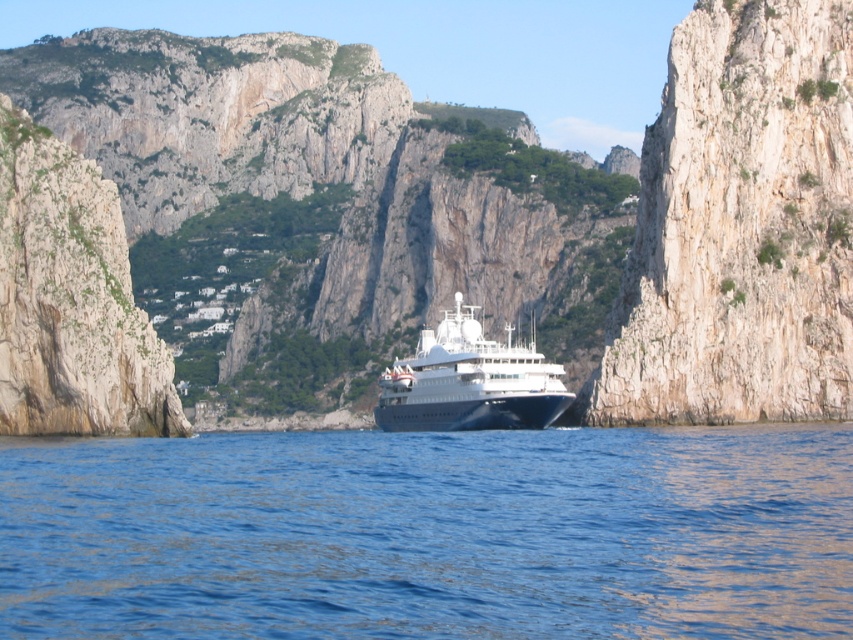
You are standing on the deck of the cruise ship in the coastal scene. You notice a point marked at coordinates (430, 221). What object is located at this point?

The point at coordinates (430, 221) indicates a white stone mountain at center.

Based on the photo, you are a photographer on the white glossy cruise ship at center, aiming to capture a photo of the white stone mountain at center. Since both objects are white, how might their positioning affect the clarity of the mountain in your photo?

The white stone mountain at center is positioned over the white glossy cruise ship at center. This overlapping might cause the mountain to blend with the ship in the photo, reducing clarity.

Looking at this image, you are a sailor navigating a ship through the narrow passage between the white stone mountain at center and the blue liquid water at center. The ship requires a minimum of 10 meters of width to safely pass. Can you determine if the passage is wide enough based on the scene?

The white stone mountain at center is wider than the blue liquid water at center. Since the ship requires a minimum of 10 meters of width to pass, and the blue liquid water at center is narrower than the mountain, it is unclear if the passage meets the requirement. Further information about the exact width of the water is needed to confirm safety.